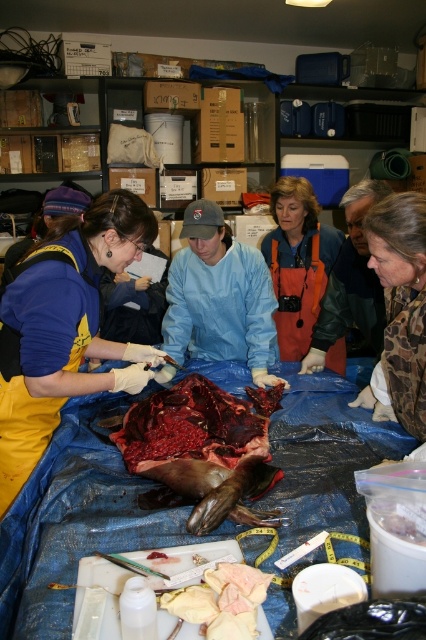
Based on the scene at the Rugged Seal Museum, where is the blue plastic table at center located in relation to the dark red flesh at center?

The blue plastic table at center is to the right of the dark red flesh at center.

You are a scientist working in the Rugged Seal Museum. You need to place a sample from the dark red flesh at center onto the blue plastic table at center. Based on their positions, will the sample fall onto the table when you let go?

The blue plastic table at center is below dark red flesh at center, so yes, the sample will fall onto the blue plastic table at center because gravity will pull it downward to the lower position.